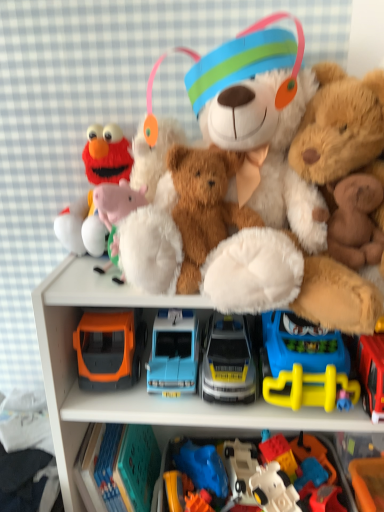
Question: Is orange plastic toy at lower right, the 1th toy in the right-to-left sequence, wider or thinner than velvet plush elmo at upper left, the first toy viewed from the left?

Choices:
 (A) wide
 (B) thin

Answer: (A)

Question: In terms of size, does orange plastic toy at lower right, the 1th toy in the right-to-left sequence, appear bigger or smaller than velvet plush elmo at upper left, the first toy viewed from the left?

Choices:
 (A) big
 (B) small

Answer: (B)

Question: Which object is positioned closest to the matte plastic toy car at center, the sixth toy when ordered from left to right?

Choices:
 (A) white plastic robot at lower center, which appears as the 7th toy when viewed from the left
 (B) blue plastic car at center, acting as the 4th toy starting from the left
 (C) velvet plush elmo at upper left, the first toy viewed from the left
 (D) fluffy brown teddy bear at right, which is counted as the 1th teddy bear, starting from the right
 (E) orange plastic toy car at lower left, which ranks as the tenth toy in right-to-left order

Answer: (A)

Question: Estimate the real-world distances between objects in this image. Which object is farther from the white plastic robot at lower center, which appears as the 7th toy when viewed from the left?

Choices:
 (A) rubberized plastic toy at lower center, the 10th toy positioned from the left
 (B) fuzzy brown teddy bear at center, positioned as the third teddy bear in right-to-left order
 (C) blue plastic car at center, the eighth toy when ordered from right to left
 (D) metallic silver car at center, which is the 5th toy from left to right
 (E) fluffy brown teddy bear at right, which is counted as the 1th teddy bear, starting from the right

Answer: (E)